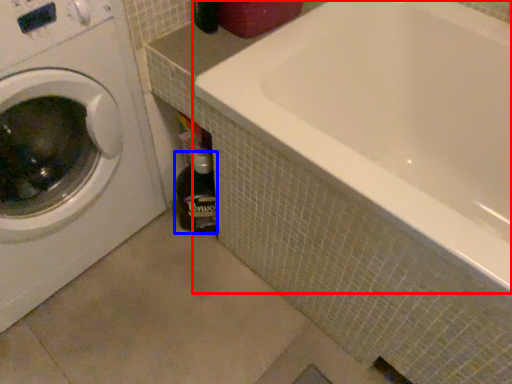
Question: Which point is further to the camera, bathtub (highlighted by a red box) or bottle (highlighted by a blue box)?

Choices:
 (A) bathtub
 (B) bottle

Answer: (B)